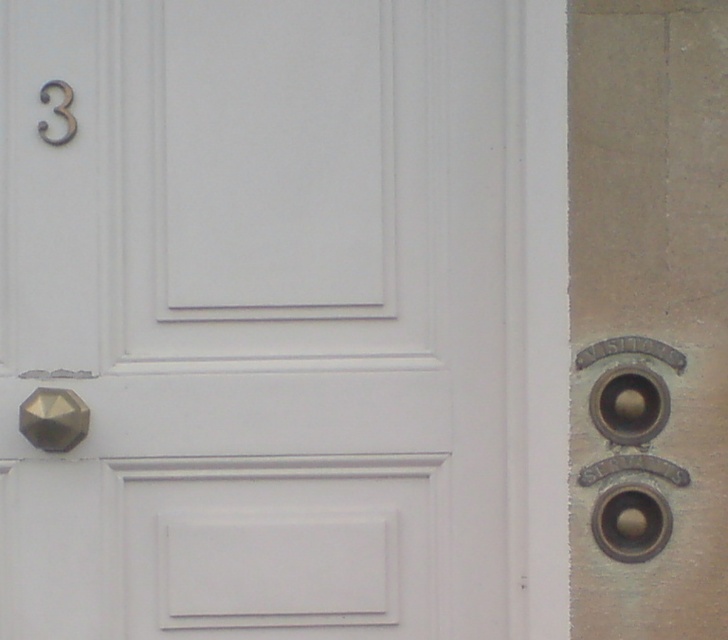
Is white matte door at center positioned behind polished brass knob at lower left?

Yes, white matte door at center is behind polished brass knob at lower left.

In the scene shown: How far apart are white matte door at center and polished brass knob at lower left?

white matte door at center and polished brass knob at lower left are 26.37 centimeters apart from each other.

Locate an element on the screen. The height and width of the screenshot is (640, 728). white matte door at center is located at coordinates (264, 320).

Which is more to the right, polished brass knob at lower left or matte gold door handle at upper left?

From the viewer's perspective, matte gold door handle at upper left appears more on the right side.

Does polished brass knob at lower left appear under matte gold door handle at upper left?

Indeed, polished brass knob at lower left is positioned under matte gold door handle at upper left.

Image resolution: width=728 pixels, height=640 pixels. I want to click on polished brass knob at lower left, so click(x=52, y=419).

Is the position of white matte door at center less distant than that of matte gold door handle at upper left?

Yes, it is in front of matte gold door handle at upper left.

Is white matte door at center bigger than matte gold door handle at upper left?

Indeed, white matte door at center has a larger size compared to matte gold door handle at upper left.

The height and width of the screenshot is (640, 728). Describe the element at coordinates (264, 320) in the screenshot. I see `white matte door at center` at that location.

What are the coordinates of `white matte door at center` in the screenshot? It's located at (264, 320).